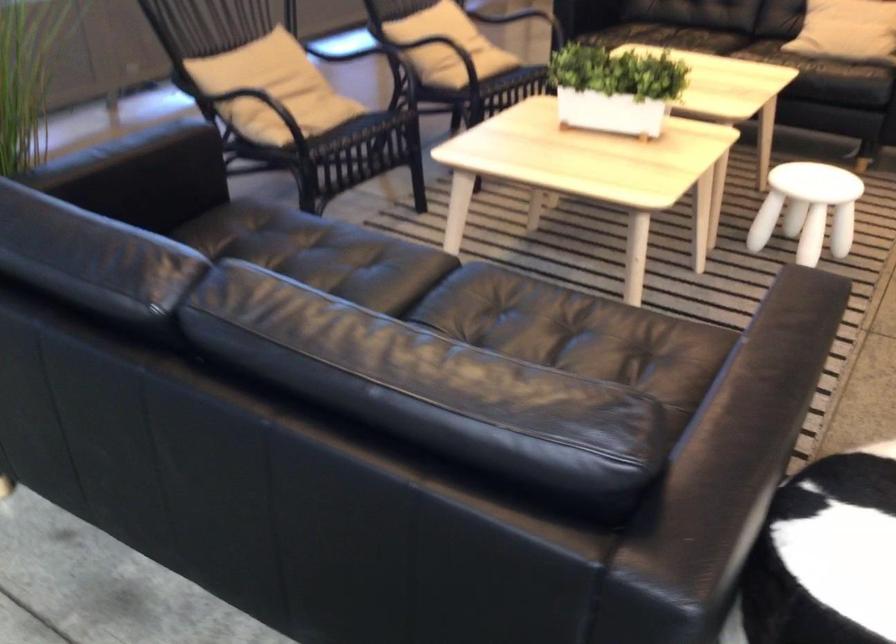
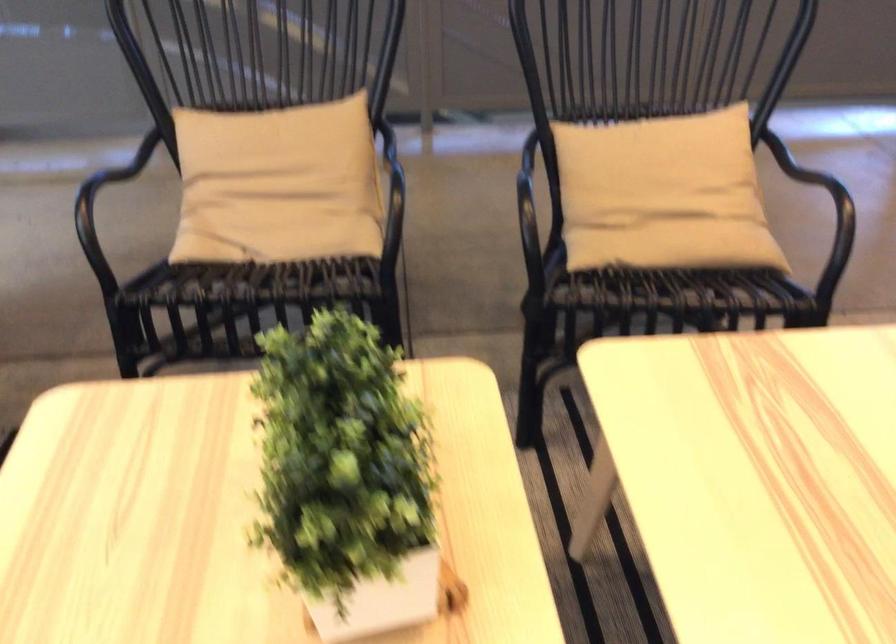
The point at (319, 138) is marked in the first image. Where is the corresponding point in the second image?

(268, 267)